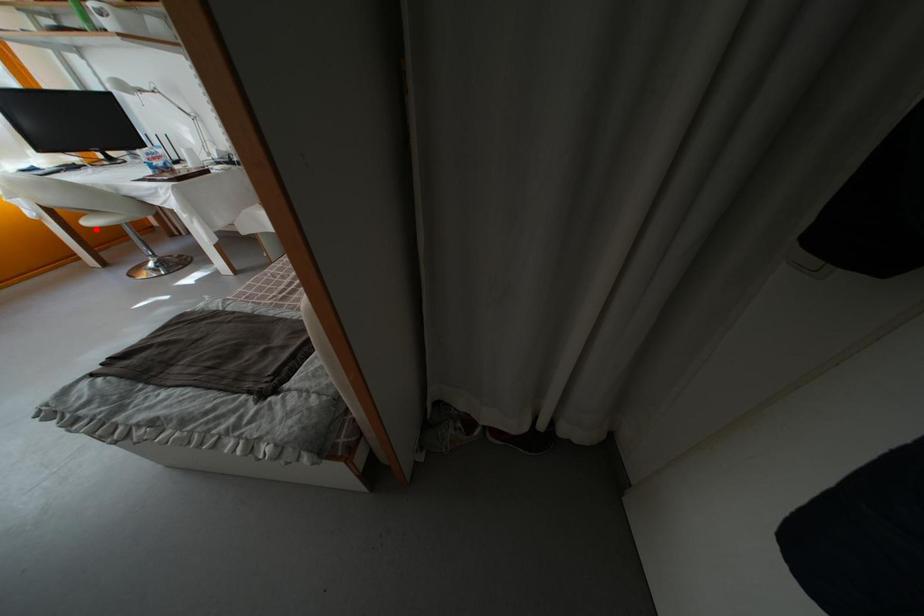
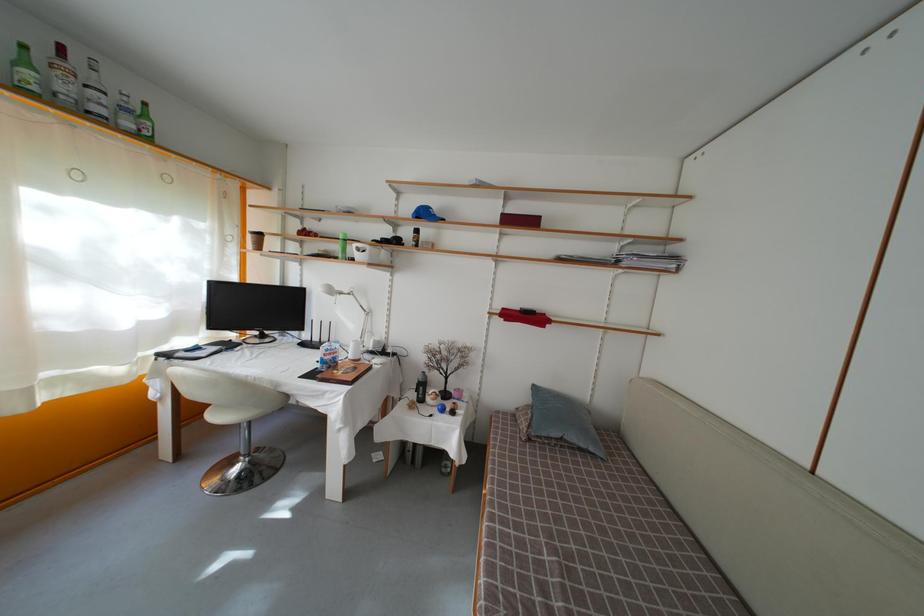
Question: A red point is marked in image1. In image2, is the corresponding 3D point closer to the camera or farther? Reply with the corresponding letter.

Choices:
 (A) The corresponding 3D point is closer.
 (B) The corresponding 3D point is farther.

Answer: (A)